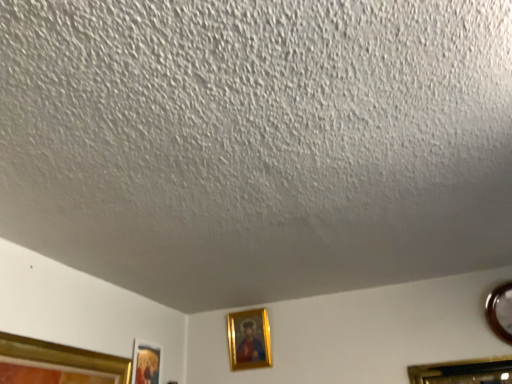
The height and width of the screenshot is (384, 512). What do you see at coordinates (146, 363) in the screenshot?
I see `gold-framed picture at lower left, the 1th picture frame positioned from the left` at bounding box center [146, 363].

Identify the location of gold-framed picture at center, the second picture frame positioned from the left. (249, 339).

Visually, is gold-framed picture at center, acting as the 2th picture frame starting from the right, positioned to the left or to the right of gold-framed picture at lower left, the 1th picture frame positioned from the left?

gold-framed picture at center, acting as the 2th picture frame starting from the right, is positioned on gold-framed picture at lower left, the 1th picture frame positioned from the left,'s right side.

In the scene shown: Which point is more forward, (234, 344) or (148, 358)?

Point (148, 358)

Is gold-framed picture at center, the second picture frame positioned from the left, further to camera compared to gold-framed picture at lower left, the 1th picture frame positioned from the left?

Yes, it is behind gold-framed picture at lower left, the 1th picture frame positioned from the left.

From a real-world perspective, is gold-framed picture at center, acting as the 2th picture frame starting from the right, positioned above or below gold-framed picture at lower left, the 1th picture frame positioned from the left?

In terms of real-world spatial position, gold-framed picture at center, acting as the 2th picture frame starting from the right, is above gold-framed picture at lower left, the 1th picture frame positioned from the left.

Is gold-framed picture at lower left, the 1th picture frame positioned from the left, in front of or behind metallic circular frame at right, the third picture frame in the left-to-right sequence, in the image?

gold-framed picture at lower left, the 1th picture frame positioned from the left, is behind metallic circular frame at right, the third picture frame in the left-to-right sequence.

In the scene shown: Which of these two, gold-framed picture at lower left, the 1th picture frame positioned from the left, or metallic circular frame at right, which is counted as the 1th picture frame, starting from the right, is smaller?

gold-framed picture at lower left, the 1th picture frame positioned from the left.

Does point (148, 354) appear closer or farther from the camera than point (493, 327)?

Point (148, 354).

Does gold-framed picture at lower left, positioned as the third picture frame in right-to-left order, have a lesser height compared to metallic circular frame at right, which is counted as the 1th picture frame, starting from the right?

No, gold-framed picture at lower left, positioned as the third picture frame in right-to-left order, is not shorter than metallic circular frame at right, which is counted as the 1th picture frame, starting from the right.

In the image, is metallic circular frame at right, the third picture frame in the left-to-right sequence, on the left side or the right side of gold-framed picture at lower left, the 1th picture frame positioned from the left?

Based on their positions, metallic circular frame at right, the third picture frame in the left-to-right sequence, is located to the right of gold-framed picture at lower left, the 1th picture frame positioned from the left.

Is metallic circular frame at right, the third picture frame in the left-to-right sequence, bigger than gold-framed picture at lower left, positioned as the third picture frame in right-to-left order?

Yes, metallic circular frame at right, the third picture frame in the left-to-right sequence, is bigger than gold-framed picture at lower left, positioned as the third picture frame in right-to-left order.

Is gold-framed picture at lower left, the 1th picture frame positioned from the left, inside metallic circular frame at right, which is counted as the 1th picture frame, starting from the right?

No, gold-framed picture at lower left, the 1th picture frame positioned from the left, is not inside metallic circular frame at right, which is counted as the 1th picture frame, starting from the right.

From the image's perspective, which object appears higher, metallic circular frame at right, the third picture frame in the left-to-right sequence, or gold-framed picture at lower left, the 1th picture frame positioned from the left?

metallic circular frame at right, the third picture frame in the left-to-right sequence.

Is gold-framed picture at center, acting as the 2th picture frame starting from the right, not near metallic circular frame at right, which is counted as the 1th picture frame, starting from the right?

Yes, gold-framed picture at center, acting as the 2th picture frame starting from the right, and metallic circular frame at right, which is counted as the 1th picture frame, starting from the right, are quite far apart.

From a real-world perspective, does gold-framed picture at center, the second picture frame positioned from the left, sit lower than metallic circular frame at right, which is counted as the 1th picture frame, starting from the right?

No.

From the image's perspective, who appears lower, gold-framed picture at center, the second picture frame positioned from the left, or metallic circular frame at right, the third picture frame in the left-to-right sequence?

gold-framed picture at center, the second picture frame positioned from the left, from the image's perspective.

Which picture frame is the 2nd one when counting from the back of the metallic circular frame at right, the third picture frame in the left-to-right sequence? Please provide its 2D coordinates.

[(249, 339)]

Is gold-framed picture at lower left, the 1th picture frame positioned from the left, positioned with its back to gold-framed picture at center, the second picture frame positioned from the left?

No, gold-framed picture at lower left, the 1th picture frame positioned from the left,'s orientation is not away from gold-framed picture at center, the second picture frame positioned from the left.

Consider the image. Is gold-framed picture at lower left, the 1th picture frame positioned from the left, closer to the viewer compared to gold-framed picture at center, the second picture frame positioned from the left?

Yes, gold-framed picture at lower left, the 1th picture frame positioned from the left, is closer to the camera.

How many degrees apart are the facing directions of gold-framed picture at lower left, the 1th picture frame positioned from the left, and gold-framed picture at center, acting as the 2th picture frame starting from the right?

There is a 87.7-degree angle between the facing directions of gold-framed picture at lower left, the 1th picture frame positioned from the left, and gold-framed picture at center, acting as the 2th picture frame starting from the right.

From the image's perspective, is gold-framed picture at lower left, positioned as the third picture frame in right-to-left order, located above or below gold-framed picture at center, the second picture frame positioned from the left?

gold-framed picture at lower left, positioned as the third picture frame in right-to-left order, is below gold-framed picture at center, the second picture frame positioned from the left.

Between point (510, 316) and point (254, 322), which one is positioned behind?

Point (254, 322)

Which of these two, metallic circular frame at right, the third picture frame in the left-to-right sequence, or gold-framed picture at center, the second picture frame positioned from the left, stands shorter?

metallic circular frame at right, the third picture frame in the left-to-right sequence, is shorter.

Find the location of a particular element. The image size is (512, 384). picture frame above the gold-framed picture at center, acting as the 2th picture frame starting from the right (from the image's perspective) is located at coordinates (500, 311).

Find the location of a particular element. picture frame below the gold-framed picture at center, the second picture frame positioned from the left (from the image's perspective) is located at coordinates (146, 363).

Image resolution: width=512 pixels, height=384 pixels. I want to click on the 1st picture frame behind the metallic circular frame at right, which is counted as the 1th picture frame, starting from the right, so click(x=146, y=363).

From the image, which object appears to be farther from gold-framed picture at lower left, positioned as the third picture frame in right-to-left order, gold-framed picture at center, the second picture frame positioned from the left, or metallic circular frame at right, which is counted as the 1th picture frame, starting from the right?

metallic circular frame at right, which is counted as the 1th picture frame, starting from the right, is further to gold-framed picture at lower left, positioned as the third picture frame in right-to-left order.

When comparing their distances from metallic circular frame at right, the third picture frame in the left-to-right sequence, does gold-framed picture at center, acting as the 2th picture frame starting from the right, or gold-framed picture at lower left, the 1th picture frame positioned from the left, seem closer?

gold-framed picture at center, acting as the 2th picture frame starting from the right, is positioned closer to the anchor metallic circular frame at right, the third picture frame in the left-to-right sequence.

Which object lies further to the anchor point metallic circular frame at right, the third picture frame in the left-to-right sequence, gold-framed picture at lower left, positioned as the third picture frame in right-to-left order, or gold-framed picture at center, the second picture frame positioned from the left?

Among the two, gold-framed picture at lower left, positioned as the third picture frame in right-to-left order, is located further to metallic circular frame at right, the third picture frame in the left-to-right sequence.

Based on their spatial positions, is metallic circular frame at right, the third picture frame in the left-to-right sequence, or gold-framed picture at center, the second picture frame positioned from the left, closer to gold-framed picture at lower left, positioned as the third picture frame in right-to-left order?

gold-framed picture at center, the second picture frame positioned from the left, is positioned closer to the anchor gold-framed picture at lower left, positioned as the third picture frame in right-to-left order.

When comparing their distances from gold-framed picture at center, the second picture frame positioned from the left, does metallic circular frame at right, which is counted as the 1th picture frame, starting from the right, or gold-framed picture at lower left, positioned as the third picture frame in right-to-left order, seem closer?

gold-framed picture at lower left, positioned as the third picture frame in right-to-left order, is positioned closer to the anchor gold-framed picture at center, the second picture frame positioned from the left.

Looking at the image, which one is located further to gold-framed picture at center, acting as the 2th picture frame starting from the right, gold-framed picture at lower left, positioned as the third picture frame in right-to-left order, or metallic circular frame at right, the third picture frame in the left-to-right sequence?

metallic circular frame at right, the third picture frame in the left-to-right sequence, is positioned further to the anchor gold-framed picture at center, acting as the 2th picture frame starting from the right.

At what (x,y) coordinates should I click in order to perform the action: click on picture frame between gold-framed picture at lower left, the 1th picture frame positioned from the left, and metallic circular frame at right, the third picture frame in the left-to-right sequence, in the horizontal direction. Please return your answer as a coordinate pair (x, y). Looking at the image, I should click on (249, 339).